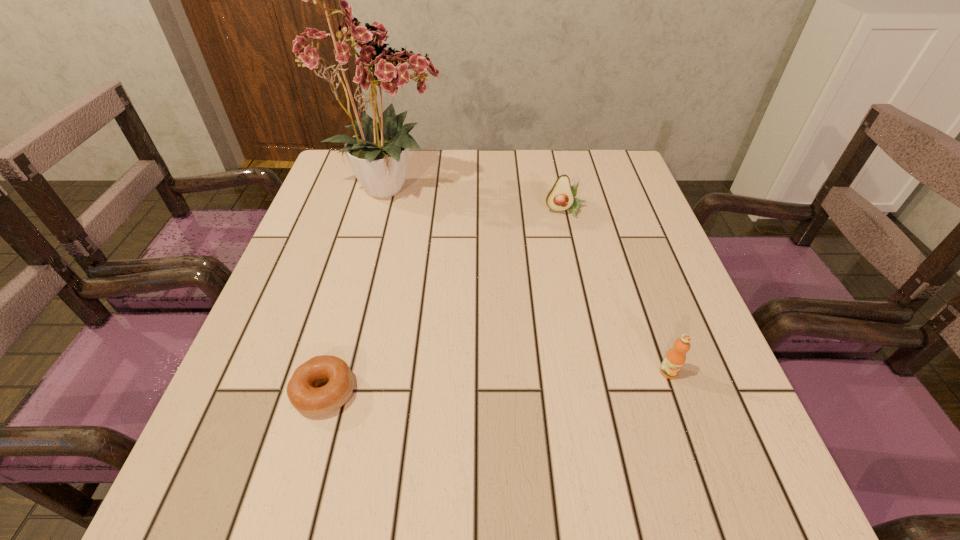
Where is `the tallest object`? This screenshot has width=960, height=540. the tallest object is located at coordinates (378, 154).

Where is `avocado`? This screenshot has height=540, width=960. avocado is located at coordinates (561, 197).

Locate an element on the screen. orange juice is located at coordinates (675, 358).

Locate an element on the screen. This screenshot has width=960, height=540. the shortest object is located at coordinates (302, 389).

Locate an element on the screen. Image resolution: width=960 pixels, height=540 pixels. free space located on the front-facing side of the tallest object is located at coordinates (518, 188).

At what (x,y) coordinates should I click in order to perform the action: click on free space located on the seed side of the second object from right to left. Please return your answer as a coordinate pair (x, y). Looking at the image, I should click on (571, 234).

This screenshot has height=540, width=960. In order to click on vacant space located on the front label of the orange juice in this screenshot , I will do `click(688, 428)`.

Where is `free space located on the right of the shortest object`? This screenshot has height=540, width=960. free space located on the right of the shortest object is located at coordinates (569, 392).

Locate an element on the screen. This screenshot has height=540, width=960. object that is at the far edge is located at coordinates (378, 154).

Find the location of `flower arrangement present at the left edge`. flower arrangement present at the left edge is located at coordinates (378, 154).